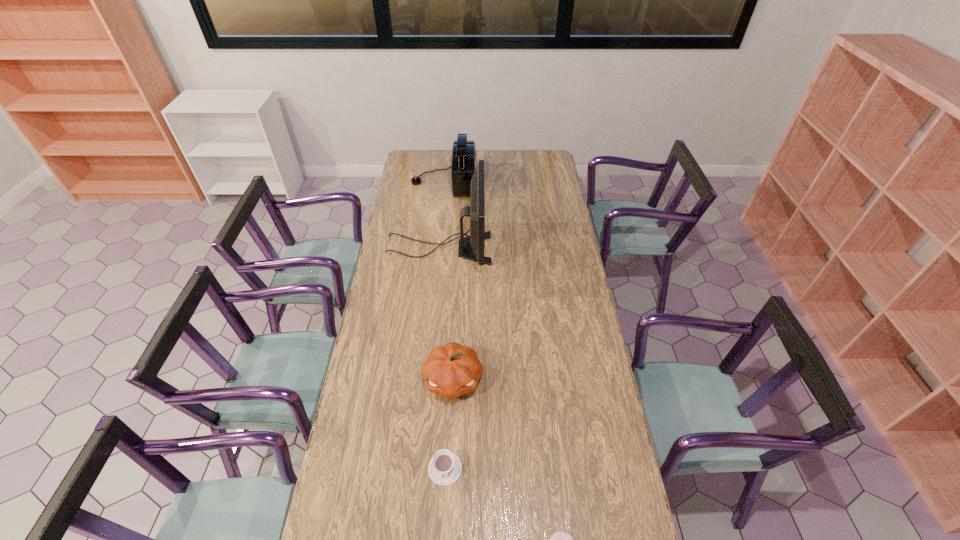
The height and width of the screenshot is (540, 960). Identify the location of the tallest object. (475, 242).

This screenshot has height=540, width=960. I want to click on computer monitor, so click(475, 242).

Find the location of `the fourth shortest object`. the fourth shortest object is located at coordinates (464, 152).

Where is `radio receiver`? The height and width of the screenshot is (540, 960). radio receiver is located at coordinates (464, 152).

In order to click on the third shortest object in this screenshot , I will do `click(451, 370)`.

Where is `pumpkin`? This screenshot has height=540, width=960. pumpkin is located at coordinates (451, 370).

This screenshot has height=540, width=960. In order to click on the fourth tallest object in this screenshot , I will do `click(445, 467)`.

Locate an element on the screen. teacup is located at coordinates (445, 467).

Where is `free region located 0.320m on the screen side of the computer monitor`? free region located 0.320m on the screen side of the computer monitor is located at coordinates (557, 249).

Identify the location of free space located on the front-facing side of the radio receiver. The height and width of the screenshot is (540, 960). (499, 181).